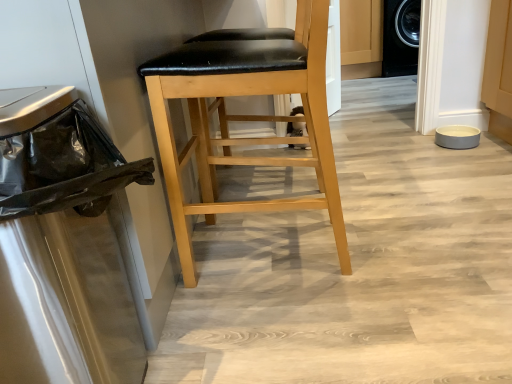
What is the approximate width of light wood/black leather stool at center?

light wood/black leather stool at center is 20.34 inches wide.

The image size is (512, 384). Describe the element at coordinates (245, 120) in the screenshot. I see `light wood/black leather stool at center` at that location.

At what (x,y) coordinates should I click in order to perform the action: click on light wood/black leather stool at center. Please return your answer as a coordinate pair (x, y). The image size is (512, 384). Looking at the image, I should click on (245, 120).

In order to click on light wood/black leather stool at center in this screenshot , I will do `click(245, 120)`.